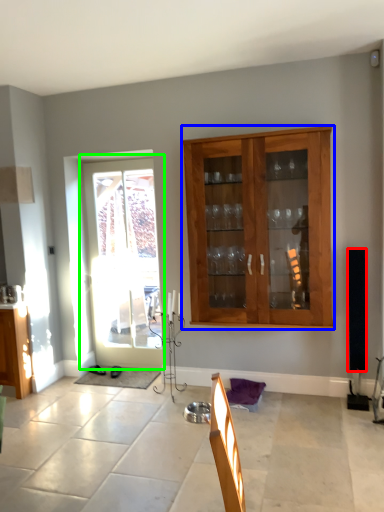
Question: Which object is the closest to the loudspeaker (highlighted by a red box)? Choose among these: cabinet (highlighted by a blue box) or door (highlighted by a green box).

Choices:
 (A) cabinet
 (B) door

Answer: (A)